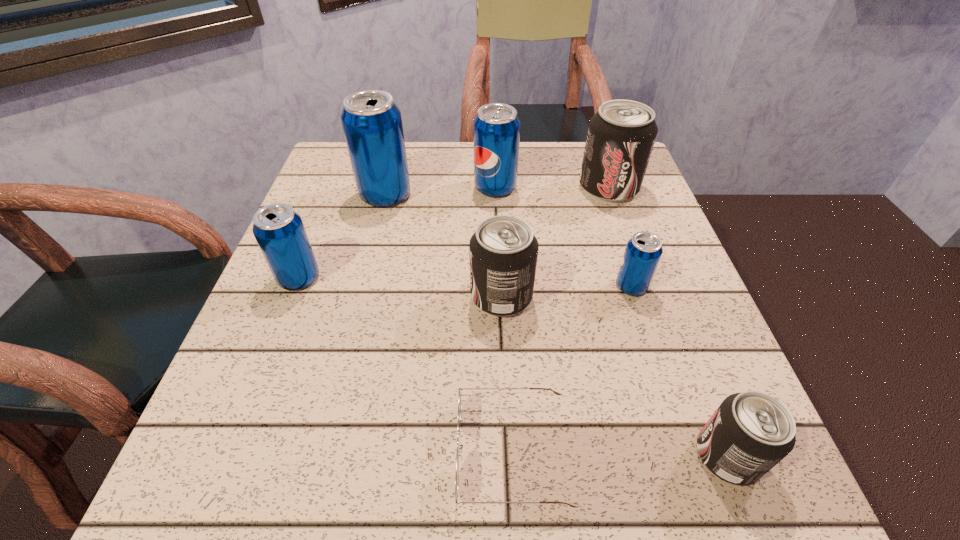
Locate an element on the screen. This screenshot has height=540, width=960. the biggest blue pop soda is located at coordinates (372, 123).

Find the location of `the third blue pop soda from right to left`. the third blue pop soda from right to left is located at coordinates click(372, 123).

The height and width of the screenshot is (540, 960). Find the location of `the farthest black soda can`. the farthest black soda can is located at coordinates (621, 135).

This screenshot has height=540, width=960. Find the location of `the second biggest blue pop soda`. the second biggest blue pop soda is located at coordinates coord(496,129).

The width and height of the screenshot is (960, 540). In order to click on the leftmost soda can in this screenshot , I will do `click(279, 231)`.

Find the location of `the leftmost blue pop soda`. the leftmost blue pop soda is located at coordinates (279, 231).

Locate an element on the screen. the second smallest black soda can is located at coordinates (503, 251).

The image size is (960, 540). What are the coordinates of `the leftmost black soda can` in the screenshot? It's located at (503, 251).

At what (x,y) coordinates should I click in order to perform the action: click on the smallest blue pop soda. Please return your answer as a coordinate pair (x, y). Looking at the image, I should click on (643, 251).

The width and height of the screenshot is (960, 540). Identify the location of the nearest black soda can. (x=750, y=432).